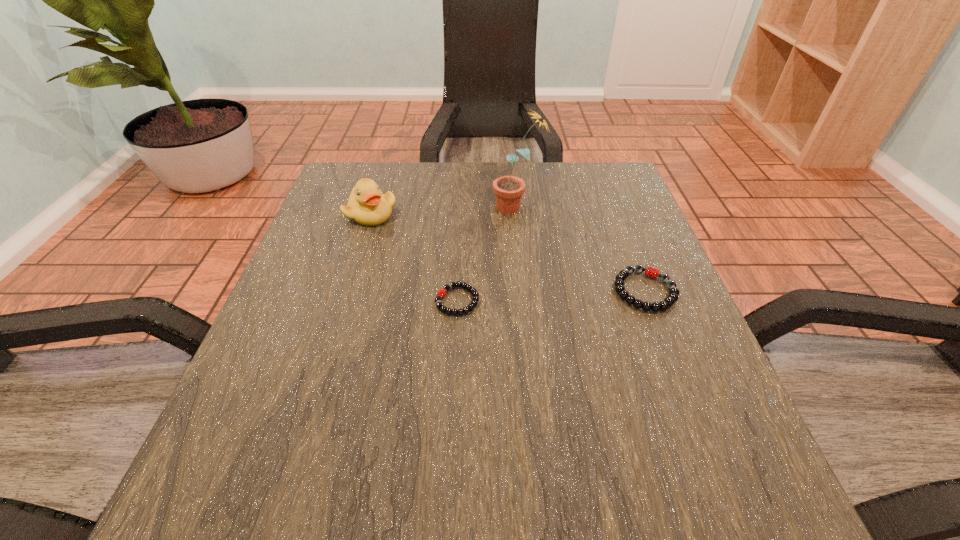
Find the location of a particular element. Image resolution: width=960 pixels, height=540 pixels. free space between the tallest object and the third object from right to left is located at coordinates (487, 254).

At what (x,y) coordinates should I click in order to perform the action: click on vacant space in between the shorter bracelet and the taller bracelet. Please return your answer as a coordinate pair (x, y). The image size is (960, 540). Looking at the image, I should click on (551, 296).

Find the location of a particular element. unoccupied area between the second tallest object and the third object from right to left is located at coordinates (414, 257).

Where is `vacant point located between the second shortest object and the duckling`? This screenshot has width=960, height=540. vacant point located between the second shortest object and the duckling is located at coordinates (508, 252).

In order to click on free space between the duckling and the taller bracelet in this screenshot , I will do `click(508, 252)`.

Locate an element on the screen. This screenshot has width=960, height=540. vacant space in between the tallest object and the shorter bracelet is located at coordinates (487, 254).

Choose which object is the nearest neighbor to the leftmost object. Please provide its 2D coordinates. Your answer should be formatted as a tuple, i.e. [(x, y)], where the tuple contains the x and y coordinates of a point satisfying the conditions above.

[(441, 293)]

Locate an element on the screen. Image resolution: width=960 pixels, height=540 pixels. object that can be found as the third closest to the second tallest object is located at coordinates (651, 272).

The width and height of the screenshot is (960, 540). I want to click on free space in the image that satisfies the following two spatial constraints: 1. on the flower of the second object from right to left; 2. on the beak of the second tallest object, so click(517, 214).

The image size is (960, 540). In order to click on vacant space that satisfies the following two spatial constraints: 1. on the flower of the tallest object; 2. on the front side of the shorter bracelet in this screenshot , I will do `click(527, 301)`.